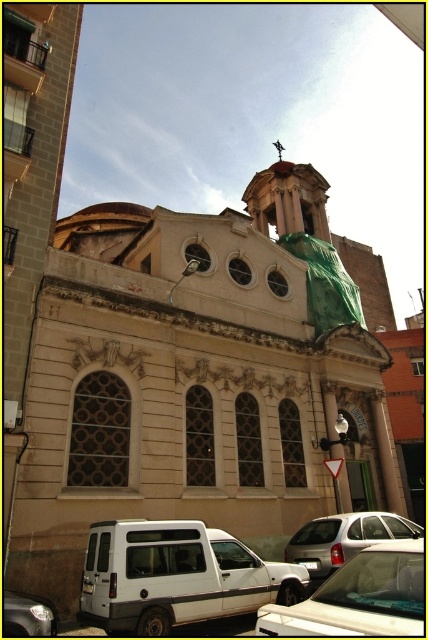
Question: Is white matte van at lower left to the left of shiny silver van at lower left from the viewer's perspective?

Choices:
 (A) no
 (B) yes

Answer: (A)

Question: From the image, what is the correct spatial relationship of beige stone church at center in relation to shiny silver van at lower left?

Choices:
 (A) right
 (B) left

Answer: (A)

Question: Based on their relative distances, which object is farther from the shiny silver van at lower left?

Choices:
 (A) white matte car at lower right
 (B) white matte van at lower left

Answer: (A)

Question: Is beige stone church at center bigger than silver metallic car at center?

Choices:
 (A) no
 (B) yes

Answer: (B)

Question: Which point is closer to the camera?

Choices:
 (A) (107, 572)
 (B) (407, 625)
 (C) (9, 598)
 (D) (285, 561)

Answer: (B)

Question: Among these objects, which one is farthest from the camera?

Choices:
 (A) beige stone church at center
 (B) silver metallic car at center

Answer: (B)